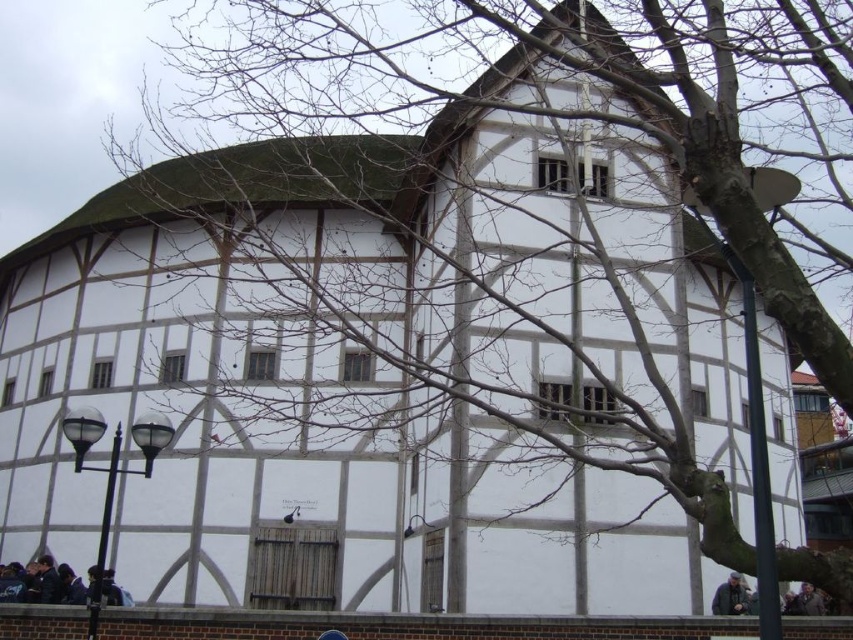
You are a photographer trying to capture the historic building without any obstructions. You notice two items, the dark gray jacket at lower right and the gray wool coat at lower right, placed near the base of the tree. Which item should you move to ensure the building is fully visible?

The dark gray jacket at lower right has a smaller width than the gray wool coat at lower right. Since the gray wool coat is wider, moving it would provide a clearer view of the building.

You are standing in front of the historic half timbered building and want to take a photo of the point at coordinate (28, 595). The camera you are using has a maximum focus range of 50 meters. Will the camera be able to focus on that point?

The point at coordinate (28, 595) is 53.97 meters away from the camera. Since the camera has a maximum focus range of 50 meters, it will not be able to focus on that point.

You are standing in front of the historic building and want to take a photo that includes both the point at coordinates (718, 602) and the point at coordinates (805, 588). Which point should you ensure is closer to the camera to include both in the frame?

You should ensure the point at coordinates (718, 602) is closer to the camera because it is in front of the point at coordinates (805, 588), allowing both to be visible in the frame.